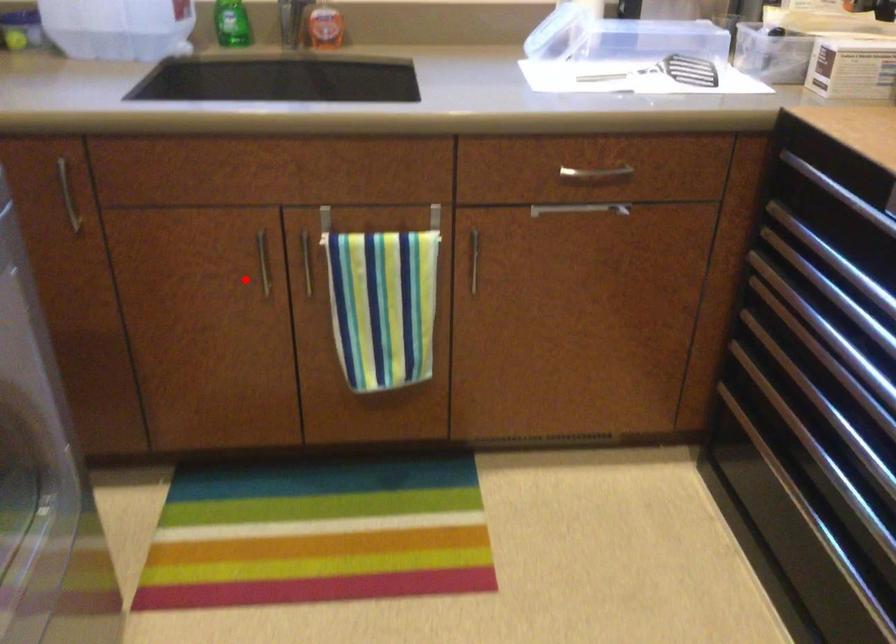
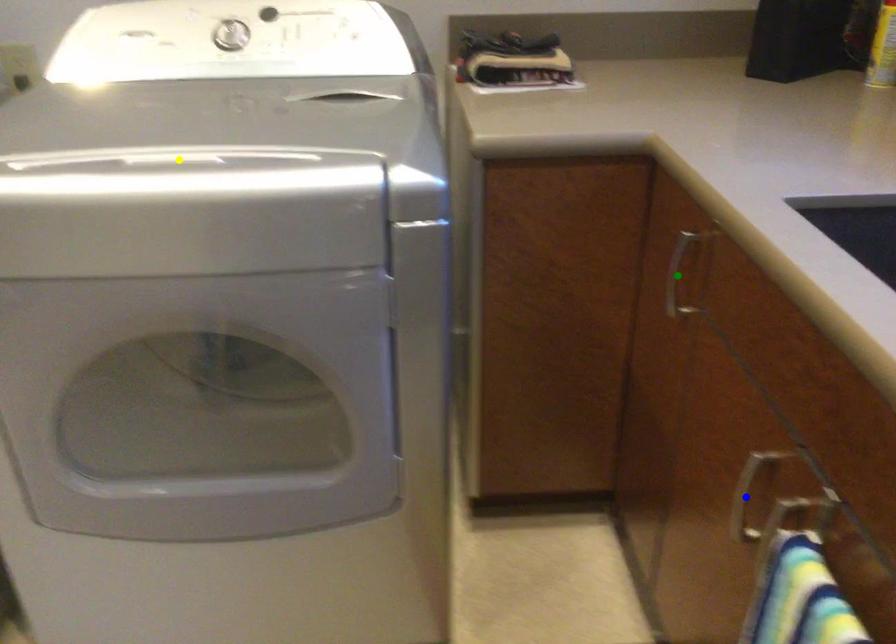
Question: I am providing you with two images of the same scene from different viewpoints. A red point is marked on the first image. You are given multiple points on the second image. Can you choose the point in image 2 that corresponds to the point in image 1?

Choices:
 (A) green point
 (B) blue point
 (C) yellow point

Answer: (B)